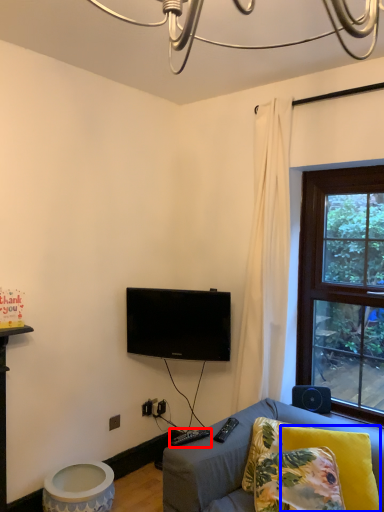
Question: Among these objects, which one is nearest to the camera, remote (highlighted by a red box) or pillow (highlighted by a blue box)?

Choices:
 (A) remote
 (B) pillow

Answer: (B)